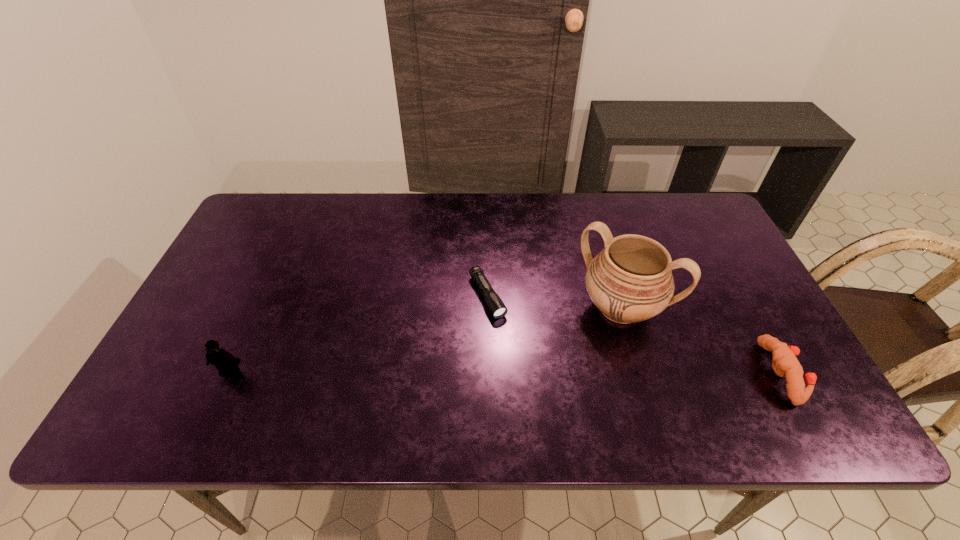
Image resolution: width=960 pixels, height=540 pixels. Find the location of `free space between the leftmost object and the tallest object`. free space between the leftmost object and the tallest object is located at coordinates (425, 340).

Where is `vacant space that's between the third object from right to left and the second object from right to left`? vacant space that's between the third object from right to left and the second object from right to left is located at coordinates (554, 302).

The height and width of the screenshot is (540, 960). What are the coordinates of `free space between the third object from right to left and the tallest object` in the screenshot? It's located at (554, 302).

Locate an element on the screen. This screenshot has width=960, height=540. free space between the flashlight and the urn is located at coordinates tap(554, 302).

In order to click on object that can be found as the closest to the leftmost object in this screenshot , I will do `click(497, 308)`.

This screenshot has height=540, width=960. In order to click on object that ranks as the closest to the tallest object in this screenshot , I will do tap(785, 364).

Locate an element on the screen. This screenshot has width=960, height=540. free location that satisfies the following two spatial constraints: 1. on the face of the second shortest object; 2. with the gloves of the leftmost object facing forward is located at coordinates point(228,373).

Where is `blank area in the image that satisfies the following two spatial constraints: 1. on the face of the leftmost object; 2. with the gloves of the second shortest object facing forward`? blank area in the image that satisfies the following two spatial constraints: 1. on the face of the leftmost object; 2. with the gloves of the second shortest object facing forward is located at coordinates (228, 373).

Identify the location of vacant position in the image that satisfies the following two spatial constraints: 1. on the face of the puncher; 2. with the gloves of the third shortest object facing forward. (228, 373).

The width and height of the screenshot is (960, 540). What are the coordinates of `free region that satisfies the following two spatial constraints: 1. on the face of the rightmost object; 2. with the gloves of the Lego facing forward` in the screenshot? It's located at (228, 373).